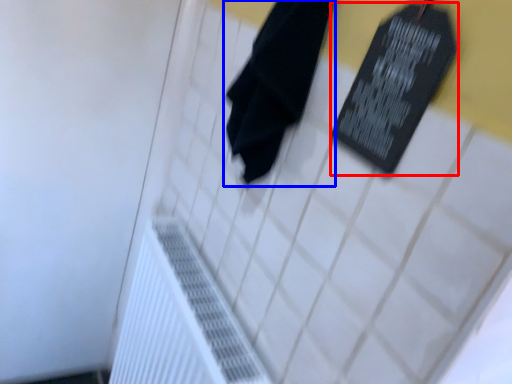
Question: Which of the following is the farthest to the observer, bulletin board (highlighted by a red box) or towel (highlighted by a blue box)?

Choices:
 (A) bulletin board
 (B) towel

Answer: (B)